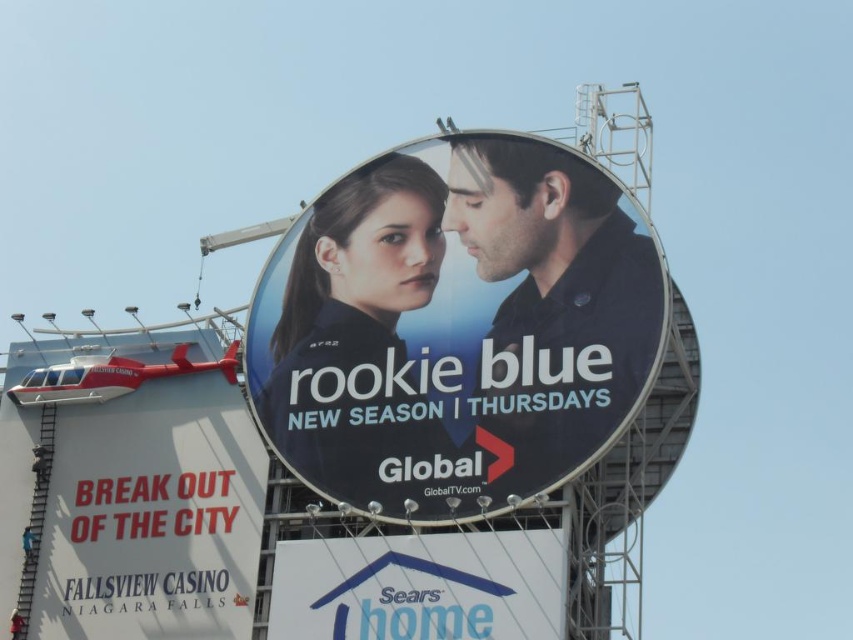
Question: Is metallic red helicopter at upper left thinner than white plastic sign at lower center?

Choices:
 (A) yes
 (B) no

Answer: (B)

Question: Does matte black shirt at center appear on the left side of white plastic sign at lower center?

Choices:
 (A) no
 (B) yes

Answer: (A)

Question: Which object is positioned closest to the metallic red helicopter at upper left?

Choices:
 (A) matte black billboard at center
 (B) white plastic sign at lower center
 (C) matte black shirt at center

Answer: (B)

Question: Can you confirm if metallic red helicopter at upper left is bigger than white plastic sign at lower center?

Choices:
 (A) no
 (B) yes

Answer: (B)

Question: Which point is farther to the camera?

Choices:
 (A) (512, 173)
 (B) (173, 520)
 (C) (544, 189)
 (D) (399, 616)

Answer: (B)

Question: Which object is the farthest from the white plastic sign at lower center?

Choices:
 (A) matte black shirt at center
 (B) metallic red helicopter at upper left

Answer: (B)